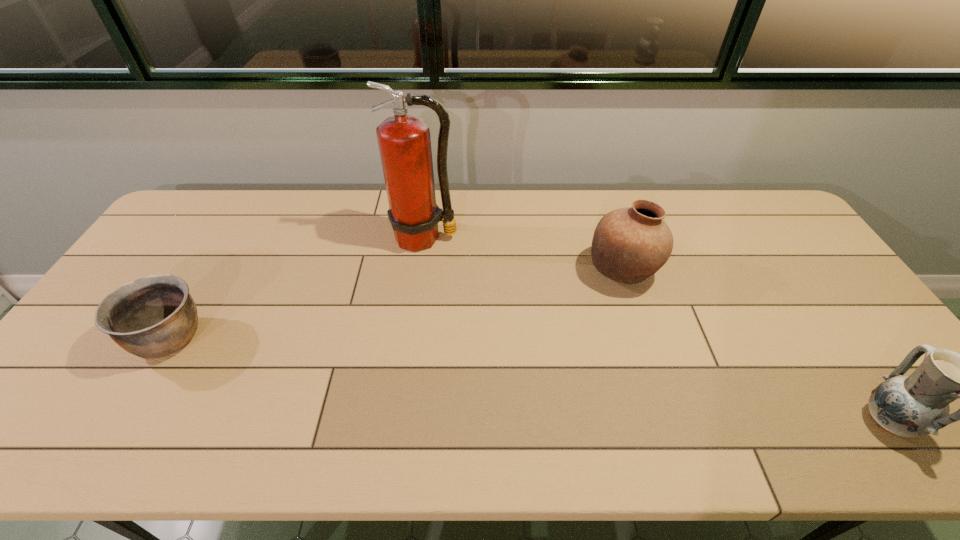
Locate an element on the screen. This screenshot has height=540, width=960. free space at the near edge of the desktop is located at coordinates (451, 438).

Where is `free space at the left edge`? This screenshot has height=540, width=960. free space at the left edge is located at coordinates (47, 394).

Find the location of a particular element. Image resolution: width=960 pixels, height=540 pixels. vacant region at the right edge of the desktop is located at coordinates (854, 355).

I want to click on empty location between the tallest object and the rightmost pottery, so click(x=656, y=329).

The width and height of the screenshot is (960, 540). I want to click on vacant area between the fire extinguisher and the farthest pottery, so click(523, 255).

You are a GUI agent. You are given a task and a screenshot of the screen. Output one action in this format:
    pyautogui.click(x=<x>, y=<y>)
    Task: Click on the free space between the second object from left to right and the third farthest object
    The height and width of the screenshot is (540, 960).
    Given the screenshot: What is the action you would take?
    pyautogui.click(x=298, y=288)

Where is `free point between the third object from left to right and the nearest pottery`? Image resolution: width=960 pixels, height=540 pixels. free point between the third object from left to right and the nearest pottery is located at coordinates (755, 346).

Find the location of a particular element. This screenshot has width=960, height=540. free area in between the second pottery from left to right and the tallest object is located at coordinates tap(523, 255).

Where is `free space between the farthest pottery and the rightmost object`? This screenshot has height=540, width=960. free space between the farthest pottery and the rightmost object is located at coordinates coord(755,346).

Locate an element on the screen. The height and width of the screenshot is (540, 960). vacant area that lies between the third object from right to left and the nearest object is located at coordinates (656, 329).